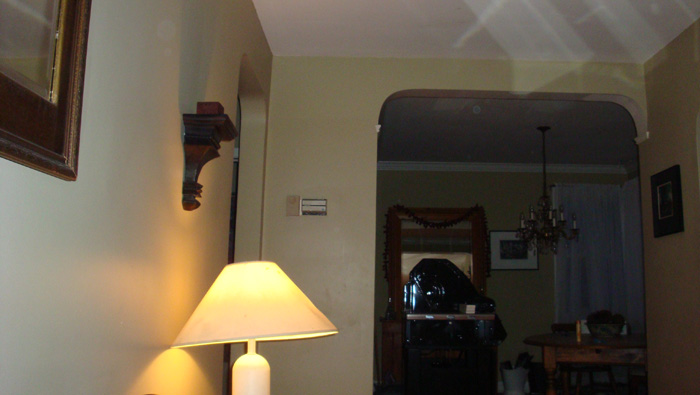
At what (x,y) coordinates should I click in order to perform the action: click on light. Please return your answer as a coordinate pair (x, y). The image size is (700, 395). Looking at the image, I should click on (166, 379).